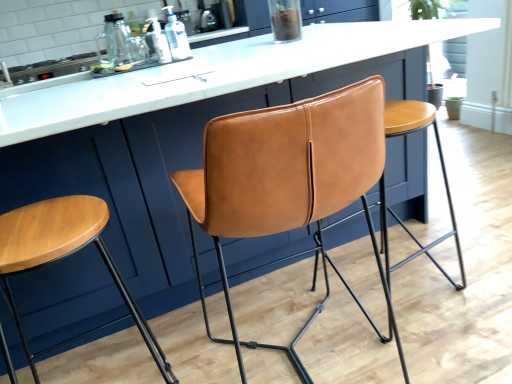
Question: Could you tell me if translucent plastic bottle at upper center, marked as the second bottle in a right-to-left arrangement, is turned towards matte leather stool at center, the 2th stool in the left-to-right sequence?

Choices:
 (A) yes
 (B) no

Answer: (B)

Question: Is the position of translucent plastic bottle at upper center, which is the 1th bottle in left-to-right order, more distant than that of matte leather stool at center, which is the 1th stool in right-to-left order?

Choices:
 (A) no
 (B) yes

Answer: (B)

Question: Is matte leather stool at center, which is the 1th stool in right-to-left order, at the back of translucent plastic bottle at upper center, which is the 1th bottle in left-to-right order?

Choices:
 (A) no
 (B) yes

Answer: (A)

Question: Is translucent plastic bottle at upper center, marked as the second bottle in a right-to-left arrangement, not within matte leather stool at center, which is the 1th stool in right-to-left order?

Choices:
 (A) no
 (B) yes

Answer: (B)

Question: Considering the relative sizes of translucent plastic bottle at upper center, marked as the second bottle in a right-to-left arrangement, and matte leather stool at center, the 2th stool in the left-to-right sequence, in the image provided, is translucent plastic bottle at upper center, marked as the second bottle in a right-to-left arrangement, smaller than matte leather stool at center, the 2th stool in the left-to-right sequence,?

Choices:
 (A) no
 (B) yes

Answer: (B)

Question: Does point (30, 79) appear closer or farther from the camera than point (253, 178)?

Choices:
 (A) closer
 (B) farther

Answer: (B)

Question: Considering the positions of metallic stove top at upper left and cognac leather chair at center in the image, is metallic stove top at upper left wider or thinner than cognac leather chair at center?

Choices:
 (A) wide
 (B) thin

Answer: (A)

Question: Is metallic stove top at upper left inside the boundaries of cognac leather chair at center, or outside?

Choices:
 (A) inside
 (B) outside

Answer: (B)

Question: From the image's perspective, relative to cognac leather chair at center, is metallic stove top at upper left above or below?

Choices:
 (A) below
 (B) above

Answer: (B)

Question: From the image's perspective, is translucent plastic bottle at upper center, marked as the second bottle in a right-to-left arrangement, above or below wooden stool at left, which appears as the 1th stool when viewed from the left?

Choices:
 (A) above
 (B) below

Answer: (A)

Question: Is point (167, 56) closer or farther from the camera than point (84, 210)?

Choices:
 (A) closer
 (B) farther

Answer: (B)

Question: In the image, is translucent plastic bottle at upper center, marked as the second bottle in a right-to-left arrangement, on the left side or the right side of wooden stool at left, marked as the 2th stool in a right-to-left arrangement?

Choices:
 (A) left
 (B) right

Answer: (B)

Question: Considering the positions of translucent plastic bottle at upper center, which is the 1th bottle in left-to-right order, and wooden stool at left, which appears as the 1th stool when viewed from the left, in the image, is translucent plastic bottle at upper center, which is the 1th bottle in left-to-right order, bigger or smaller than wooden stool at left, which appears as the 1th stool when viewed from the left,?

Choices:
 (A) small
 (B) big

Answer: (A)

Question: From a real-world perspective, relative to wooden stool at left, which appears as the 1th stool when viewed from the left, is matte leather stool at center, the 2th stool in the left-to-right sequence, vertically above or below?

Choices:
 (A) above
 (B) below

Answer: (B)

Question: Is point (381, 188) closer or farther from the camera than point (90, 215)?

Choices:
 (A) closer
 (B) farther

Answer: (B)